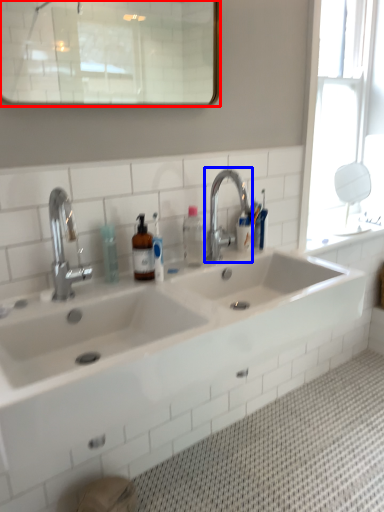
Question: Which point is further to the camera, mirror (highlighted by a red box) or tap (highlighted by a blue box)?

Choices:
 (A) mirror
 (B) tap

Answer: (B)